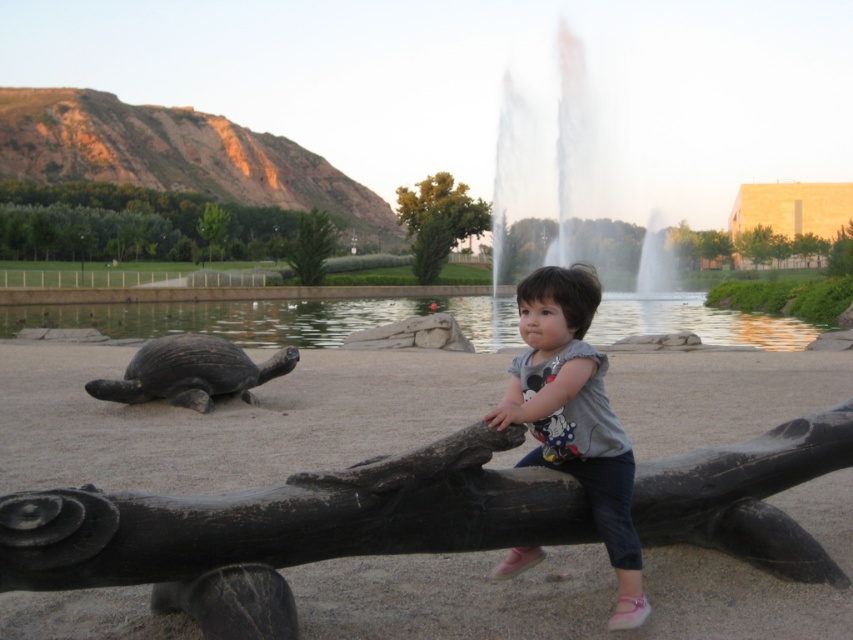
Question: Estimate the real-world distances between objects in this image. Which object is closer to the dark brown textured tortoise at left?

Choices:
 (A) transparent glass water at upper center
 (B) matte gray shirt at center
 (C) smooth dark wood log at center

Answer: (C)

Question: Which point is closer to the camera taking this photo?

Choices:
 (A) (222, 508)
 (B) (566, 422)
 (C) (546, 202)
 (D) (212, 369)

Answer: (A)

Question: Does smooth dark wood log at center appear over matte gray shirt at center?

Choices:
 (A) yes
 (B) no

Answer: (B)

Question: Which object is farther from the camera taking this photo?

Choices:
 (A) dark brown textured tortoise at left
 (B) matte gray shirt at center
 (C) transparent glass water at upper center
 (D) smooth dark wood log at center

Answer: (C)

Question: Can you confirm if smooth dark wood log at center is positioned above transparent glass water at upper center?

Choices:
 (A) yes
 (B) no

Answer: (B)

Question: Does matte gray shirt at center come behind dark brown textured tortoise at left?

Choices:
 (A) yes
 (B) no

Answer: (B)